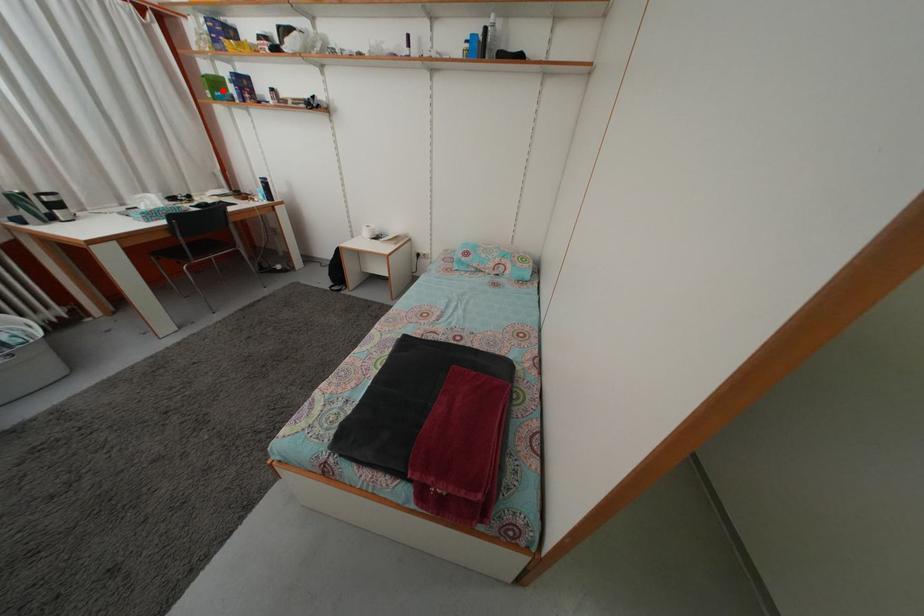
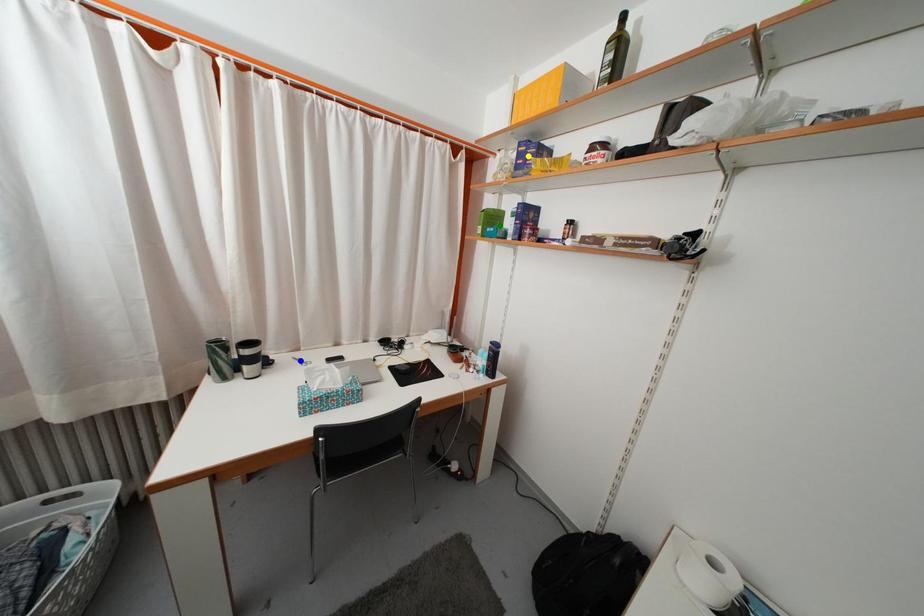
Question: I am providing you with two images of the same scene from different viewpoints. A red point is marked on the first image. You are given multiple points on the second image. Which point in image 2 is actually the same real-world point as the red point in image 1?

Choices:
 (A) yellow point
 (B) green point
 (C) blue point

Answer: (B)